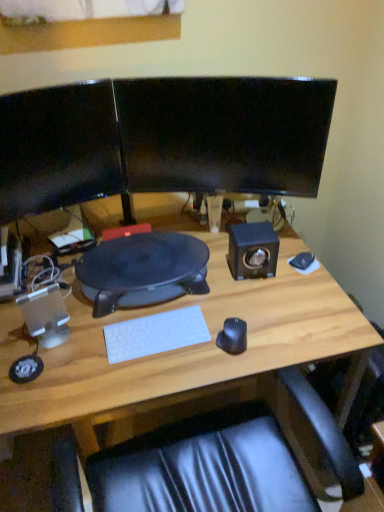
Where is `free space in front of black matte mouse at center`? free space in front of black matte mouse at center is located at coordinates (229, 368).